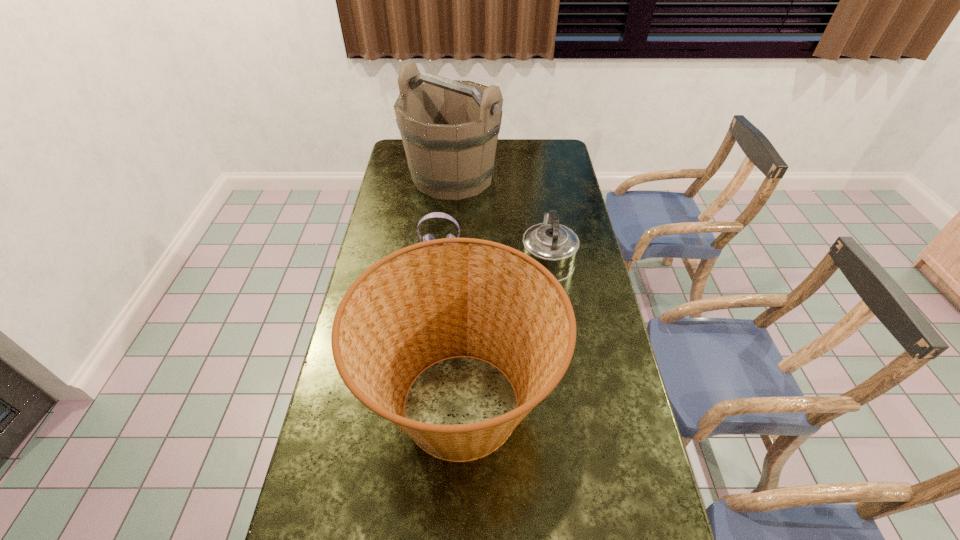
What are the coordinates of `the farthest object` in the screenshot? It's located at 449,128.

This screenshot has width=960, height=540. I want to click on the tallest object, so click(x=449, y=128).

Find the location of a particular element. The image size is (960, 540). the nearest object is located at coordinates (491, 302).

Identify the location of basket. (491, 302).

Find the location of a particular element. The image size is (960, 540). kettle is located at coordinates (555, 246).

Identify the location of headset. The image size is (960, 540). (427, 237).

This screenshot has width=960, height=540. Find the location of `vacant space situated on the back of the farthest object`. vacant space situated on the back of the farthest object is located at coordinates (455, 143).

Where is `free space located on the back of the basket`? This screenshot has width=960, height=540. free space located on the back of the basket is located at coordinates (465, 271).

Identify the location of vacant point located with the spout at the front of the third tallest object. The width and height of the screenshot is (960, 540). (540, 210).

You are a GUI agent. You are given a task and a screenshot of the screen. Output one action in this format:
    pyautogui.click(x=<x>, y=<y>)
    Task: Click on the free region located 0.090m with the spout at the front of the third tallest object
    This screenshot has width=960, height=540.
    Given the screenshot: What is the action you would take?
    pyautogui.click(x=541, y=219)